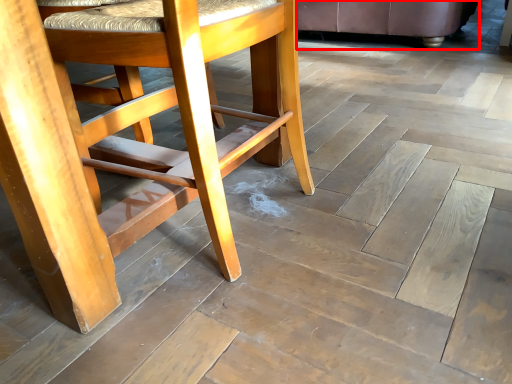
Question: Considering the relative positions of chair (annotated by the red box) and chair in the image provided, where is chair (annotated by the red box) located with respect to the staircase?

Choices:
 (A) left
 (B) right

Answer: (B)